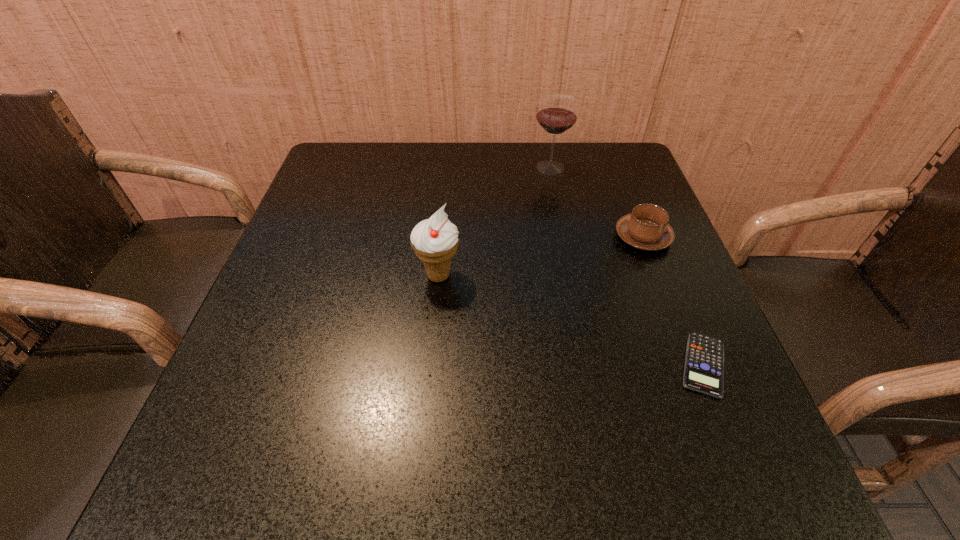
In order to click on vacant area situated 0.120m on the side of the third nearest object with the handle in this screenshot , I will do `click(624, 189)`.

The height and width of the screenshot is (540, 960). In order to click on free space located on the side of the third nearest object with the handle in this screenshot , I will do `click(610, 152)`.

At what (x,y) coordinates should I click in order to perform the action: click on vacant space located 0.220m on the side of the third nearest object with the handle. Please return your answer as a coordinate pair (x, y). This screenshot has width=960, height=540. Looking at the image, I should click on (615, 166).

This screenshot has height=540, width=960. I want to click on free location located on the left of the shortest object, so click(517, 364).

You are a GUI agent. You are given a task and a screenshot of the screen. Output one action in this format:
    pyautogui.click(x=<x>, y=<y>)
    Task: Click on the object located at the far edge
    
    Given the screenshot: What is the action you would take?
    pyautogui.click(x=557, y=113)

The width and height of the screenshot is (960, 540). Identify the location of cappuccino present at the right edge. (646, 228).

You are a GUI agent. You are given a task and a screenshot of the screen. Output one action in this format:
    pyautogui.click(x=<x>, y=<y>)
    Task: Click on the calculator at the right edge
    The height and width of the screenshot is (540, 960).
    Given the screenshot: What is the action you would take?
    pyautogui.click(x=704, y=362)

Find the location of `free space at the far edge of the desktop`. free space at the far edge of the desktop is located at coordinates (393, 180).

I want to click on vacant area at the near edge, so click(569, 445).

Identify the location of vacant space at the right edge of the desktop. (640, 321).